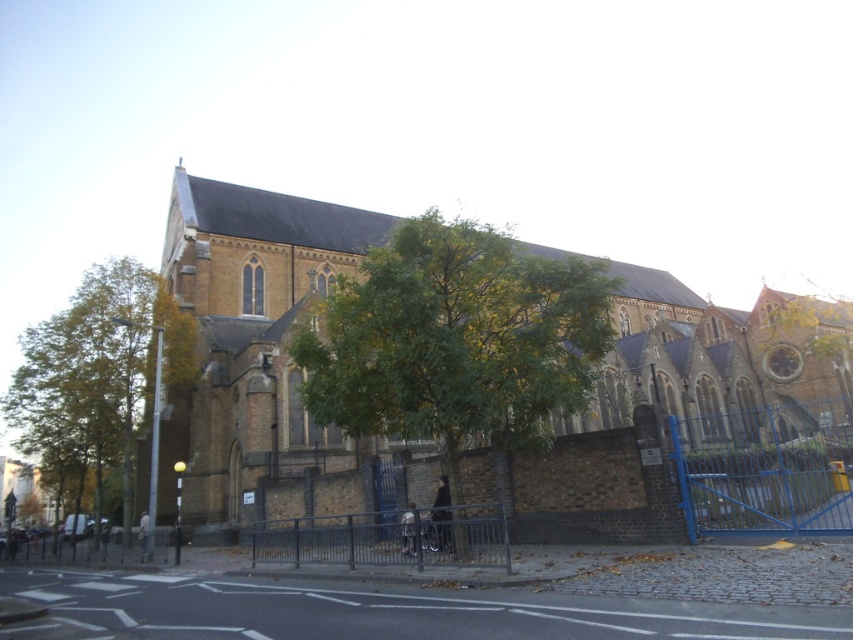
Question: Can you confirm if green leafy tree at left is positioned to the left of silver metallic fence at center?

Choices:
 (A) yes
 (B) no

Answer: (A)

Question: Based on their relative distances, which object is farther from the blue metallic gate at right?

Choices:
 (A) metallic gray fence at lower left
 (B) brown brick church at center
 (C) silver metallic fence at center

Answer: (A)

Question: Is the position of green leafy tree at center more distant than that of metallic gray fence at lower left?

Choices:
 (A) no
 (B) yes

Answer: (A)

Question: Which point appears farthest from the camera in this image?

Choices:
 (A) tap(306, 344)
 (B) tap(132, 385)
 (C) tap(260, 403)
 (D) tap(810, 428)

Answer: (D)

Question: Does green leafy tree at left appear over silver metallic fence at center?

Choices:
 (A) no
 (B) yes

Answer: (B)

Question: Among these objects, which one is farthest from the camera?

Choices:
 (A) brown brick church at center
 (B) silver metallic fence at center
 (C) blue metallic gate at right
 (D) green leafy tree at center

Answer: (A)